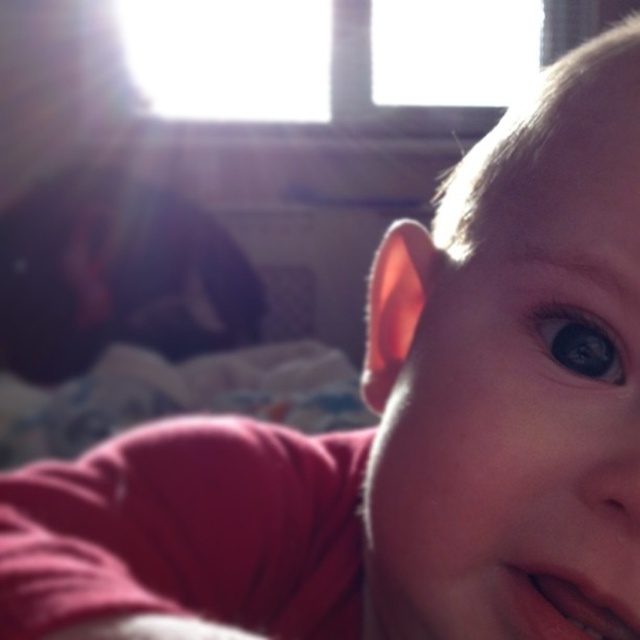
Question: Which point is farther from the camera taking this photo?

Choices:
 (A) (612, 625)
 (B) (547, 346)

Answer: (B)

Question: In this image, where is pink glossy lips at lower right located relative to shiny blue eye at center?

Choices:
 (A) left
 (B) right

Answer: (A)

Question: Is pink glossy lips at lower right closer to camera compared to shiny blue eye at center?

Choices:
 (A) yes
 (B) no

Answer: (A)

Question: Is pink glossy lips at lower right smaller than shiny blue eye at center?

Choices:
 (A) yes
 (B) no

Answer: (B)

Question: Which point is farther to the camera?

Choices:
 (A) (525, 308)
 (B) (550, 580)

Answer: (A)

Question: Among these objects, which one is nearest to the camera?

Choices:
 (A) shiny blue eye at center
 (B) pink glossy lips at lower right

Answer: (B)